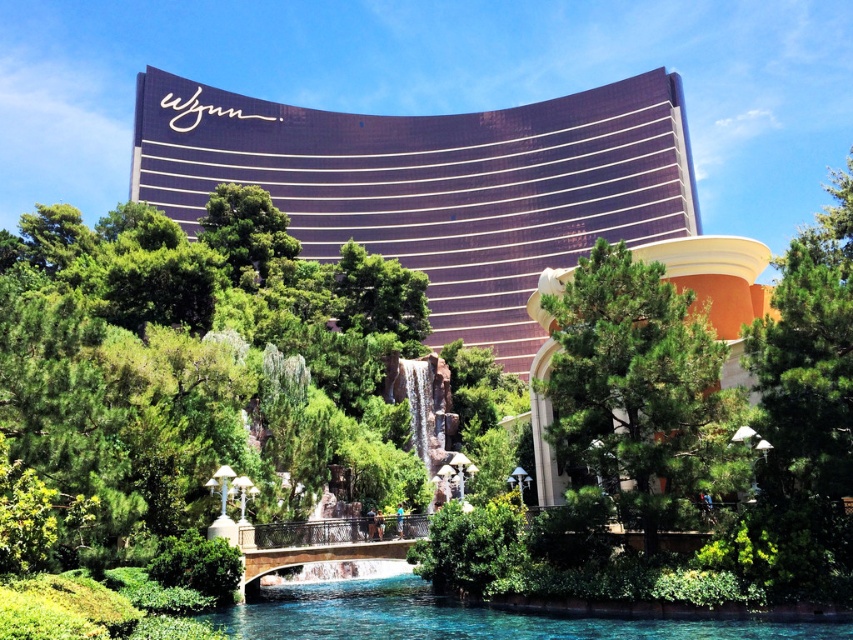
Question: Among these objects, which one is nearest to the camera?

Choices:
 (A) clear blue water at lower center
 (B) metallic gold hotel at upper center

Answer: (A)

Question: Where is green pine tree at center located in relation to clear blue water at lower center in the image?

Choices:
 (A) right
 (B) left

Answer: (A)

Question: Is metallic gold hotel at upper center thinner than clear blue water at lower center?

Choices:
 (A) no
 (B) yes

Answer: (A)

Question: Which point is closer to the camera taking this photo?

Choices:
 (A) 506,150
 (B) 663,620

Answer: (B)

Question: Which object appears farthest from the camera in this image?

Choices:
 (A) clear blue water at lower center
 (B) green pine tree at center
 (C) metallic gold hotel at upper center

Answer: (C)

Question: Does metallic gold hotel at upper center appear on the left side of green pine tree at center?

Choices:
 (A) no
 (B) yes

Answer: (B)